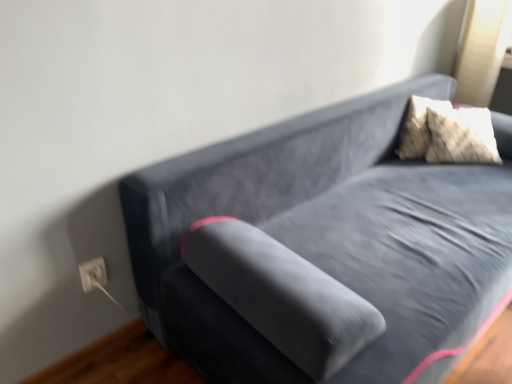
Question: Is white plastic electric outlet at lower left inside or outside of brown wood flooring at lower left?

Choices:
 (A) inside
 (B) outside

Answer: (B)

Question: Is point (91, 261) closer or farther from the camera than point (90, 354)?

Choices:
 (A) closer
 (B) farther

Answer: (A)

Question: Is white plastic electric outlet at lower left in front of or behind brown wood flooring at lower left in the image?

Choices:
 (A) front
 (B) behind

Answer: (B)

Question: From their relative heights in the image, would you say brown wood flooring at lower left is taller or shorter than white plastic electric outlet at lower left?

Choices:
 (A) short
 (B) tall

Answer: (A)

Question: Based on their sizes in the image, would you say brown wood flooring at lower left is bigger or smaller than white plastic electric outlet at lower left?

Choices:
 (A) big
 (B) small

Answer: (A)

Question: Is brown wood flooring at lower left situated inside white plastic electric outlet at lower left or outside?

Choices:
 (A) outside
 (B) inside

Answer: (A)

Question: Based on their positions, is brown wood flooring at lower left located to the left or right of white plastic electric outlet at lower left?

Choices:
 (A) right
 (B) left

Answer: (B)